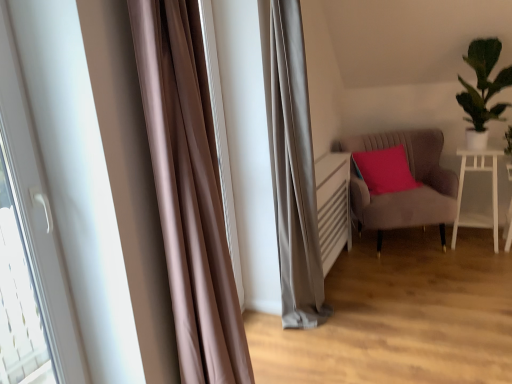
This screenshot has width=512, height=384. I want to click on vacant area that is in front of suede-like beige armchair at right, so click(x=416, y=284).